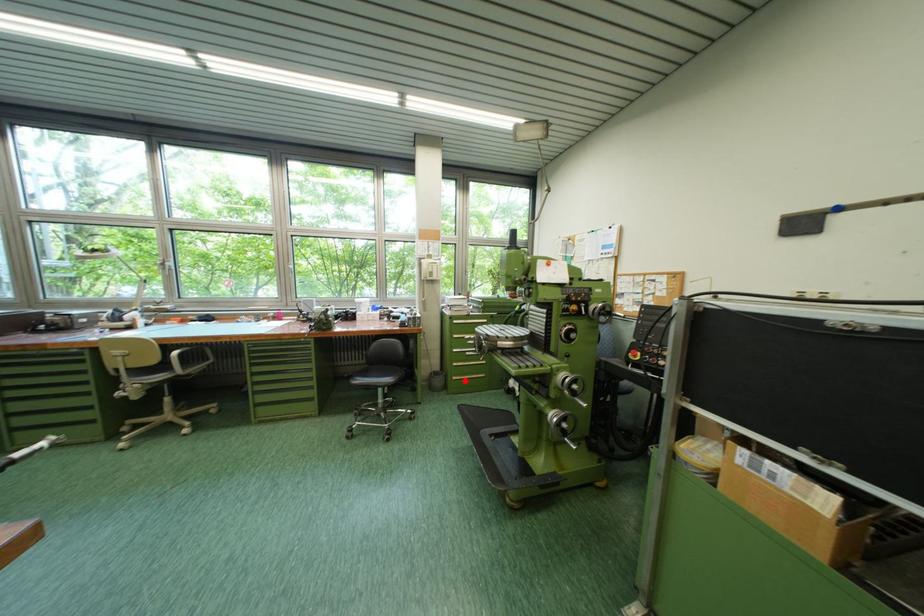
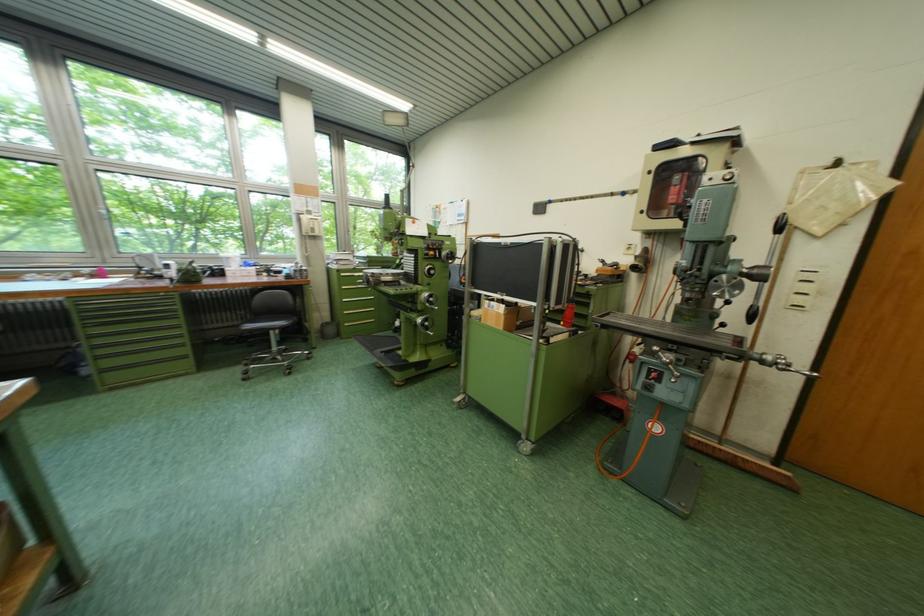
In the second image, find the point that corresponds to the highlighted location in the first image.

(357, 326)